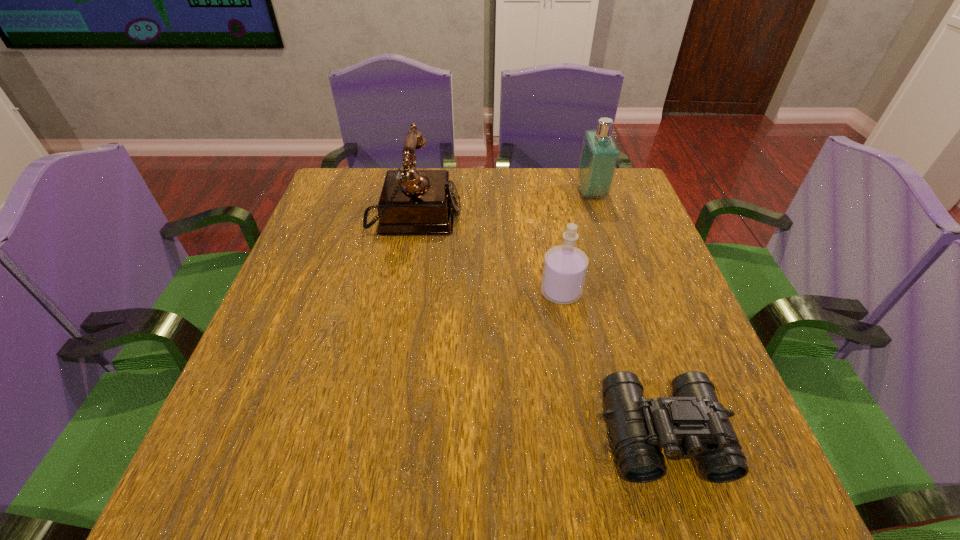
This screenshot has height=540, width=960. Find the location of `vacant point that satisfies the following two spatial constraints: 1. on the front label of the farther perfume; 2. through the lenses of the nearest object`. vacant point that satisfies the following two spatial constraints: 1. on the front label of the farther perfume; 2. through the lenses of the nearest object is located at coordinates (x=669, y=434).

The width and height of the screenshot is (960, 540). I want to click on vacant space that satisfies the following two spatial constraints: 1. on the front label of the right perfume; 2. through the lenses of the shortest object, so click(669, 434).